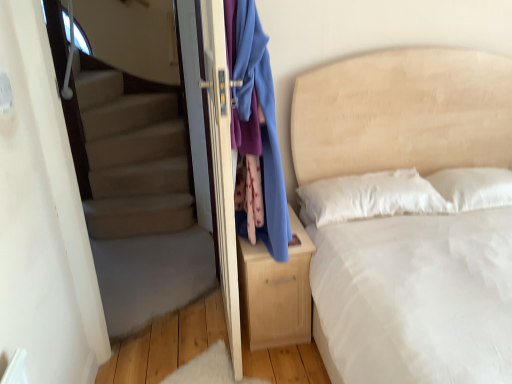
Question: Can you confirm if beige fabric bed at center is thinner than carpeted stairs at left?

Choices:
 (A) yes
 (B) no

Answer: (B)

Question: Is beige fabric bed at center directly adjacent to carpeted stairs at left?

Choices:
 (A) yes
 (B) no

Answer: (B)

Question: From the image's perspective, is beige fabric bed at center located above carpeted stairs at left?

Choices:
 (A) no
 (B) yes

Answer: (A)

Question: From the image's perspective, would you say beige fabric bed at center is shown under carpeted stairs at left?

Choices:
 (A) no
 (B) yes

Answer: (B)

Question: Is beige fabric bed at center smaller than carpeted stairs at left?

Choices:
 (A) no
 (B) yes

Answer: (A)

Question: Looking at the image, does light wood nightstand at center seem bigger or smaller compared to carpeted stairs at left?

Choices:
 (A) big
 (B) small

Answer: (A)

Question: From the image's perspective, is light wood nightstand at center positioned above or below carpeted stairs at left?

Choices:
 (A) below
 (B) above

Answer: (A)

Question: Does point (266, 345) appear closer or farther from the camera than point (110, 190)?

Choices:
 (A) farther
 (B) closer

Answer: (B)

Question: From a real-world perspective, is light wood nightstand at center positioned above or below carpeted stairs at left?

Choices:
 (A) above
 (B) below

Answer: (B)

Question: From a real-world perspective, relative to blue fabric at center, is beige fabric bed at center vertically above or below?

Choices:
 (A) above
 (B) below

Answer: (B)

Question: Is beige fabric bed at center spatially inside blue fabric at center, or outside of it?

Choices:
 (A) outside
 (B) inside

Answer: (A)

Question: Based on their positions, is beige fabric bed at center located to the left or right of blue fabric at center?

Choices:
 (A) left
 (B) right

Answer: (B)

Question: Is beige fabric bed at center taller or shorter than blue fabric at center?

Choices:
 (A) short
 (B) tall

Answer: (B)

Question: In terms of height, does beige fabric bed at center look taller or shorter compared to matte white screen door at center?

Choices:
 (A) tall
 (B) short

Answer: (B)

Question: Is beige fabric bed at center in front of or behind matte white screen door at center in the image?

Choices:
 (A) front
 (B) behind

Answer: (A)